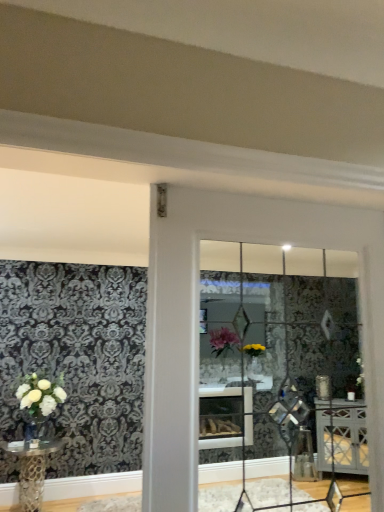
At what (x,y) coordinates should I click in order to perform the action: click on white matte vase at left. Please return your answer as a coordinate pair (x, y). Looking at the image, I should click on (40, 394).

Find the location of a particular element. The image size is (384, 512). clear glass door at center is located at coordinates (275, 377).

This screenshot has width=384, height=512. Find the location of `metallic gold table at lower left`. metallic gold table at lower left is located at coordinates (32, 471).

Looking at their sizes, would you say white matte vase at left is wider or thinner than clear glass door at center?

Clearly, white matte vase at left has more width compared to clear glass door at center.

Locate an element on the screen. This screenshot has height=512, width=384. glass window above the white matte vase at left (from the image's perspective) is located at coordinates (275, 377).

From the image's perspective, is white matte vase at left above clear glass door at center?

No, from the image's perspective, white matte vase at left is not over clear glass door at center.

Are white matte vase at left and clear glass door at center far apart?

white matte vase at left is far away from clear glass door at center.

Considering the relative sizes of white matte vase at left and clear glass vase at lower left in the image provided, is white matte vase at left smaller than clear glass vase at lower left?

No, white matte vase at left is not smaller than clear glass vase at lower left.

This screenshot has height=512, width=384. What are the coordinates of `flower that appears above the clear glass vase at lower left (from the image's perspective)` in the screenshot? It's located at (40, 394).

Is white matte vase at left at the left side of clear glass vase at lower left?

Indeed, white matte vase at left is positioned on the left side of clear glass vase at lower left.

In terms of width, does white matte vase at left look wider or thinner when compared to clear glass vase at lower left?

Clearly, white matte vase at left has more width compared to clear glass vase at lower left.

Does metallic gold table at lower left have a larger size compared to clear glass door at center?

Indeed, metallic gold table at lower left has a larger size compared to clear glass door at center.

In terms of height, does metallic gold table at lower left look taller or shorter compared to clear glass door at center?

In the image, metallic gold table at lower left appears to be shorter than clear glass door at center.

From the image's perspective, is metallic gold table at lower left located above or below clear glass door at center?

metallic gold table at lower left is situated lower than clear glass door at center in the image.

In the scene shown: Are metallic gold table at lower left and clear glass door at center located far from each other?

Yes.

Is clear glass vase at lower left far from metallic gold table at lower left?

Actually, clear glass vase at lower left and metallic gold table at lower left are a little close together.

Identify the location of glass vase above the metallic gold table at lower left (from a real-world perspective). The image size is (384, 512). (33, 431).

Is clear glass vase at lower left inside the boundaries of metallic gold table at lower left, or outside?

clear glass vase at lower left cannot be found inside metallic gold table at lower left.

Based on the photo, does clear glass vase at lower left turn towards metallic gold table at lower left?

No, clear glass vase at lower left is not facing towards metallic gold table at lower left.

Would you say clear glass door at center is inside or outside clear glass vase at lower left?

clear glass door at center is not inside clear glass vase at lower left, it's outside.

Considering the positions of objects clear glass door at center and clear glass vase at lower left in the image provided, who is more to the right, clear glass door at center or clear glass vase at lower left?

clear glass door at center is more to the right.

Considering the relative sizes of clear glass door at center and clear glass vase at lower left in the image provided, is clear glass door at center wider than clear glass vase at lower left?

No.

From a real-world perspective, which is physically above, clear glass door at center or clear glass vase at lower left?

clear glass door at center, from a real-world perspective.

Between metallic gold table at lower left and white matte vase at left, which one has smaller width?

white matte vase at left.

Does metallic gold table at lower left have a smaller size compared to white matte vase at left?

No, metallic gold table at lower left is not smaller than white matte vase at left.

From a real-world perspective, which is physically below, metallic gold table at lower left or white matte vase at left?

metallic gold table at lower left, from a real-world perspective.

Can you tell me how much metallic gold table at lower left and white matte vase at left differ in facing direction?

metallic gold table at lower left and white matte vase at left are facing 0.0736 degrees away from each other.

Does point (301, 362) come farther from viewer compared to point (0, 442)?

No, it is in front of (0, 442).

Is clear glass door at center bigger than metallic gold table at lower left?

No.

Is clear glass door at center touching metallic gold table at lower left?

No, clear glass door at center is not touching metallic gold table at lower left.

Find the location of a particular element. The width and height of the screenshot is (384, 512). flower that appears on the left of clear glass door at center is located at coordinates (40, 394).

At what (x,y) coordinates should I click in order to perform the action: click on flower above the clear glass vase at lower left (from the image's perspective). Please return your answer as a coordinate pair (x, y). The width and height of the screenshot is (384, 512). Looking at the image, I should click on (40, 394).

From the image, which object appears to be nearer to metallic gold table at lower left, white matte vase at left or clear glass door at center?

white matte vase at left lies closer to metallic gold table at lower left than the other object.

Looking at the image, which one is located closer to white matte vase at left, clear glass door at center or metallic gold table at lower left?

metallic gold table at lower left.

Looking at the image, which one is located closer to clear glass vase at lower left, clear glass door at center or white matte vase at left?

Based on the image, white matte vase at left appears to be nearer to clear glass vase at lower left.

From the picture: Which object lies further to the anchor point clear glass vase at lower left, clear glass door at center or metallic gold table at lower left?

The object further to clear glass vase at lower left is clear glass door at center.

When comparing their distances from clear glass vase at lower left, does white matte vase at left or clear glass door at center seem closer?

The object closer to clear glass vase at lower left is white matte vase at left.

Which object lies nearer to the anchor point white matte vase at left, clear glass door at center or clear glass vase at lower left?

Based on the image, clear glass vase at lower left appears to be nearer to white matte vase at left.

Looking at the image, which one is located closer to clear glass vase at lower left, white matte vase at left or metallic gold table at lower left?

white matte vase at left is closer to clear glass vase at lower left.

Based on their spatial positions, is clear glass door at center or clear glass vase at lower left further from metallic gold table at lower left?

Among the two, clear glass door at center is located further to metallic gold table at lower left.

Image resolution: width=384 pixels, height=512 pixels. Find the location of `table positioned between clear glass door at center and white matte vase at left from near to far`. table positioned between clear glass door at center and white matte vase at left from near to far is located at coordinates (32, 471).

In order to click on flower between clear glass door at center and clear glass vase at lower left from front to back in this screenshot , I will do `click(40, 394)`.

Identify the location of glass vase between white matte vase at left and metallic gold table at lower left from top to bottom. [33, 431].

Where is `table located between clear glass door at center and clear glass vase at lower left in the depth direction`? table located between clear glass door at center and clear glass vase at lower left in the depth direction is located at coordinates (32, 471).